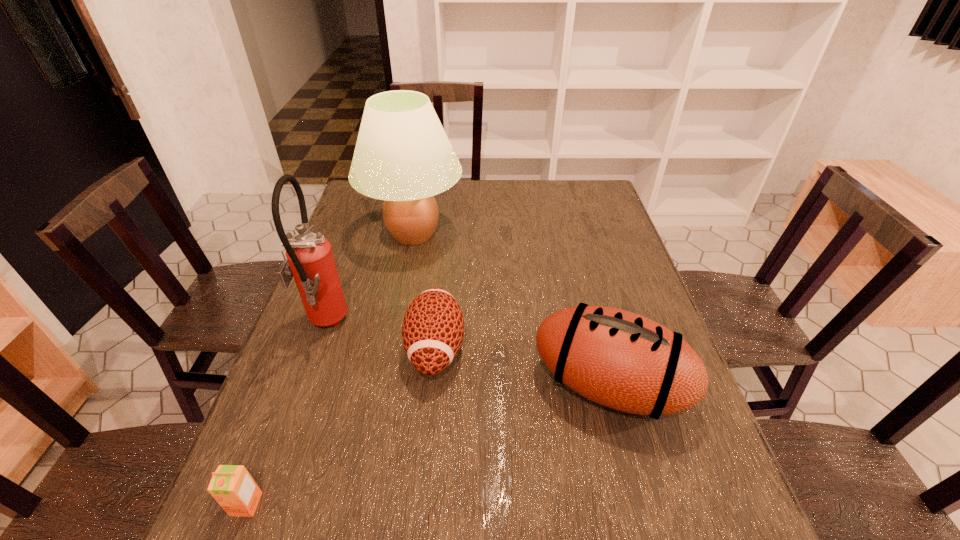
The height and width of the screenshot is (540, 960). I want to click on free spot located on the back of the right football, so click(x=575, y=258).

The width and height of the screenshot is (960, 540). Identify the location of free region located 0.170m on the back of the fourth tallest object. (444, 269).

This screenshot has width=960, height=540. I want to click on vacant space situated on the right of the nearest object, so coord(445,504).

This screenshot has height=540, width=960. Find the location of `object at the far edge`. object at the far edge is located at coordinates (403, 156).

At what (x,y) coordinates should I click in order to perform the action: click on lampshade present at the left edge. Please return your answer as a coordinate pair (x, y). The width and height of the screenshot is (960, 540). Looking at the image, I should click on (403, 156).

The width and height of the screenshot is (960, 540). I want to click on fire extinguisher that is at the left edge, so click(x=310, y=260).

Find the location of a particular element. Image resolution: width=960 pixels, height=540 pixels. orange juice situated at the left edge is located at coordinates (232, 486).

Where is `object that is at the right edge`? This screenshot has width=960, height=540. object that is at the right edge is located at coordinates (619, 359).

At what (x,y) coordinates should I click in order to perform the action: click on object present at the far left corner. Please return your answer as a coordinate pair (x, y). This screenshot has height=540, width=960. Looking at the image, I should click on (403, 156).

Where is `vacant area at the far edge of the desktop`? vacant area at the far edge of the desktop is located at coordinates coord(516,182).